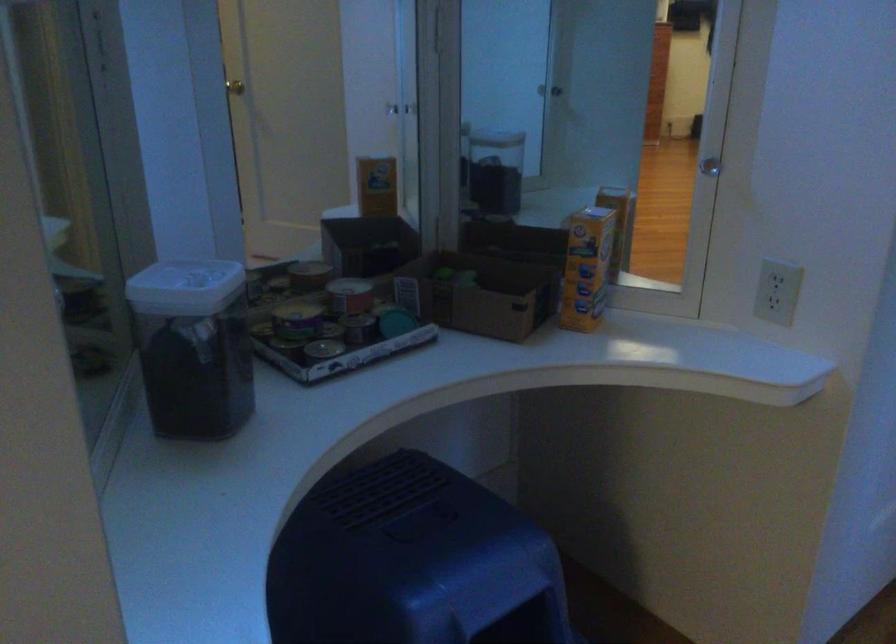
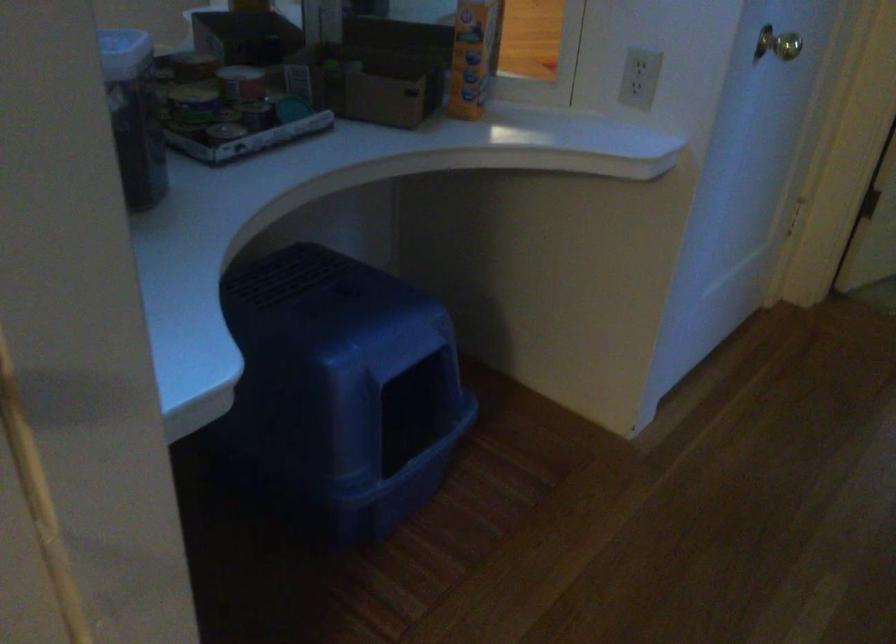
The point at (x=589, y=270) is marked in the first image. Where is the corresponding point in the second image?

(472, 57)